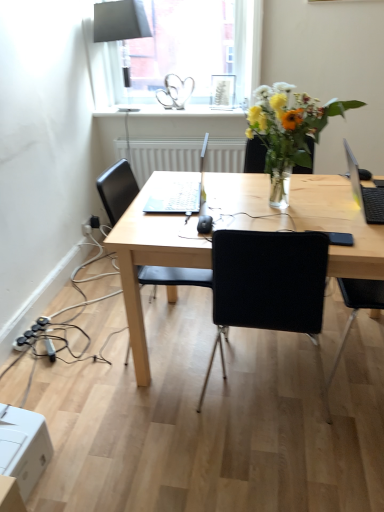
This screenshot has width=384, height=512. Identify the location of unoccupied space behind black plastic mouse at center. (214, 206).